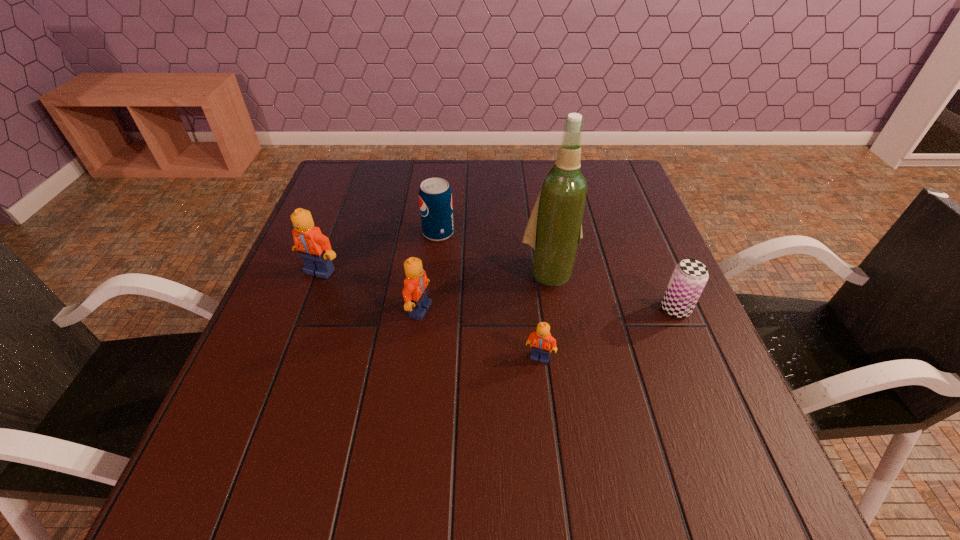
At what (x,y) coordinates should I click in order to perform the action: click on free point that keeps the Legos evenly spaced on the right. Please return your answer as a coordinate pair (x, y). This screenshot has width=960, height=540. Looking at the image, I should click on (687, 415).